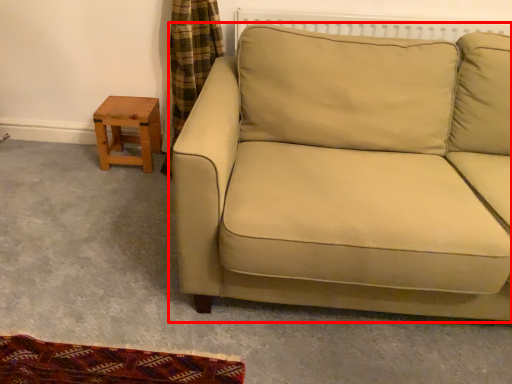
Question: Where is studio couch (annotated by the red box) located in relation to table in the image?

Choices:
 (A) right
 (B) left

Answer: (A)